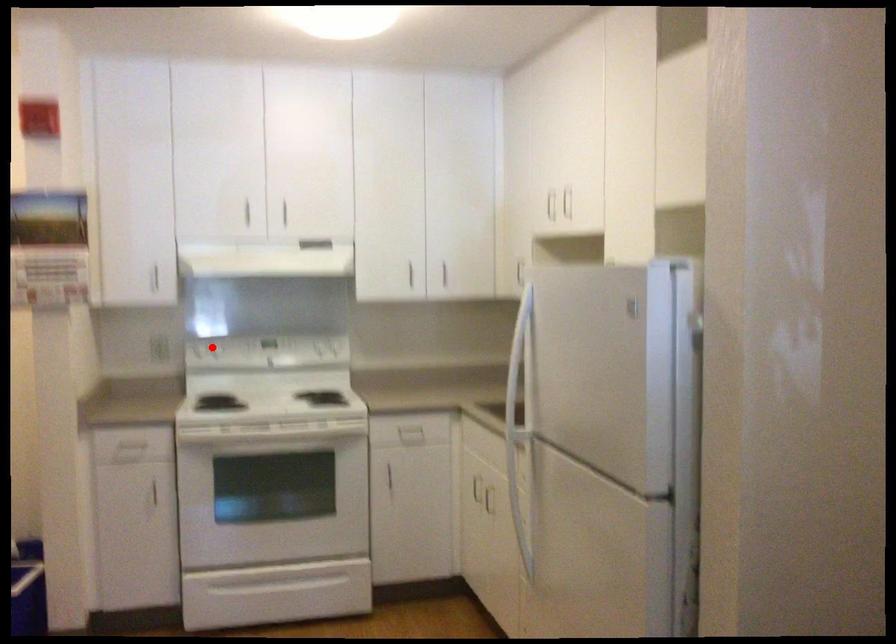
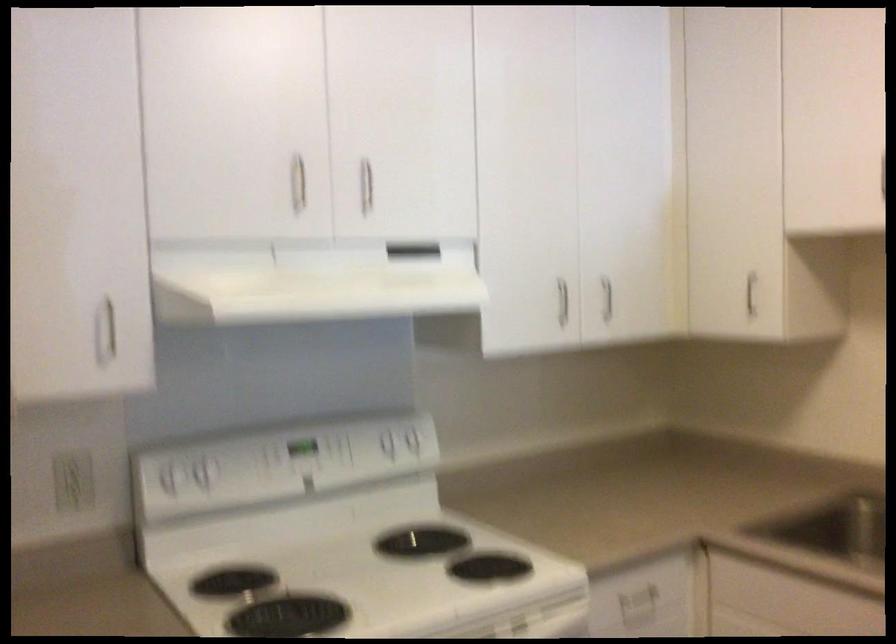
Question: I am providing you with two images of the same scene from different viewpoints. In image1, a red point is highlighted. Considering the same 3D point in image2, which of the following is correct?

Choices:
 (A) It is closer
 (B) It is farther

Answer: (A)